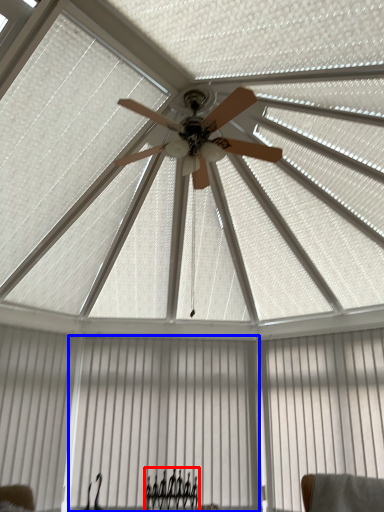
Question: Which of the following is the farthest to the observer, furniture (highlighted by a red box) or curtain (highlighted by a blue box)?

Choices:
 (A) furniture
 (B) curtain

Answer: (B)